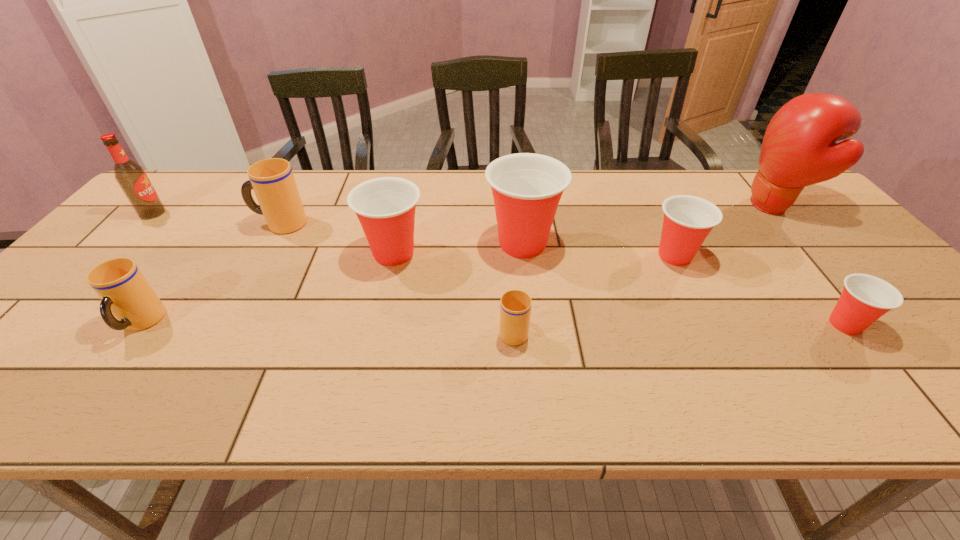
Where is `free point that satisfies the following two spatial constraints: 1. on the side of the smallest beige cup with the handle; 2. on the right side of the rightmost cup`? The image size is (960, 540). free point that satisfies the following two spatial constraints: 1. on the side of the smallest beige cup with the handle; 2. on the right side of the rightmost cup is located at coordinates (513, 325).